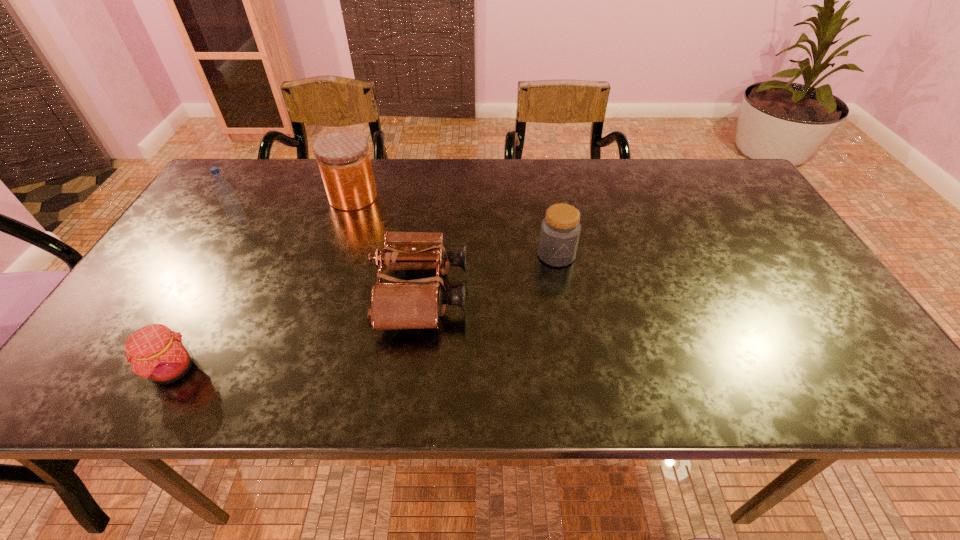
You are a GUI agent. You are given a task and a screenshot of the screen. Output one action in this format:
    pyautogui.click(x=<x>, y=<y>)
    Task: Click on the free space between the farthest object and the nearer jar
    The width and height of the screenshot is (960, 540).
    Given the screenshot: What is the action you would take?
    pyautogui.click(x=455, y=226)

Locate an element on the screen. This screenshot has width=960, height=540. vacant space that's between the jam and the second object from right to left is located at coordinates (298, 331).

This screenshot has width=960, height=540. I want to click on object that is the third closest to the shorter jar, so click(156, 353).

The height and width of the screenshot is (540, 960). I want to click on the third closest object relative to the taller jar, so click(x=560, y=229).

Where is `free space that satisfies the following two spatial constraints: 1. on the surface of the right jar near the warning symbol; 2. through the eyepieces of the binoculars`? free space that satisfies the following two spatial constraints: 1. on the surface of the right jar near the warning symbol; 2. through the eyepieces of the binoculars is located at coordinates (563, 293).